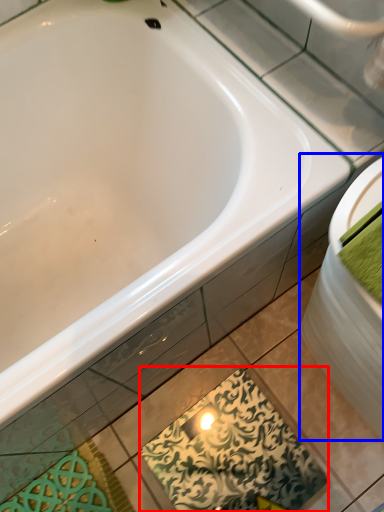
Question: Which object appears farthest to the camera in this image, design (highlighted by a red box) or sink (highlighted by a blue box)?

Choices:
 (A) design
 (B) sink

Answer: (A)